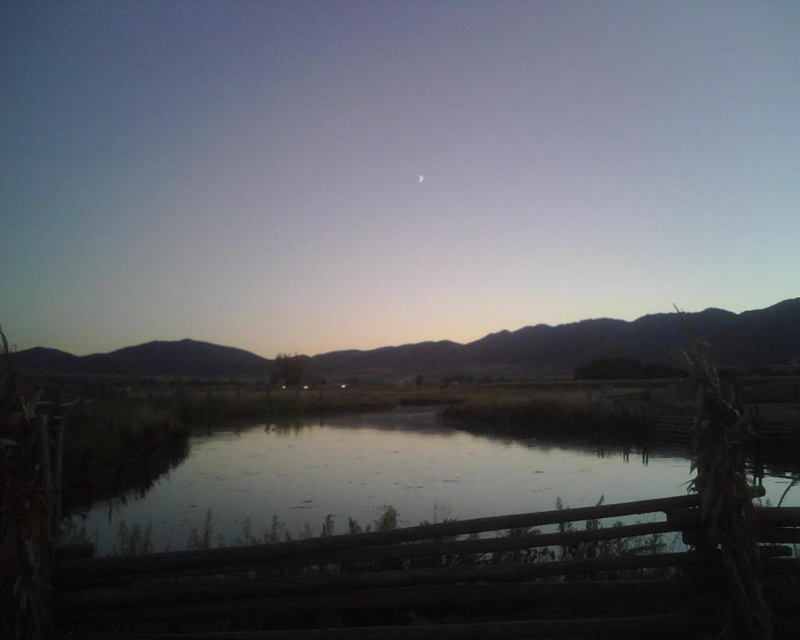
Question: Which of the following is the farthest from the observer?

Choices:
 (A) smooth reflective water at center
 (B) brown matte mountain at center

Answer: (B)

Question: Can you confirm if smooth reflective water at center is positioned to the right of brown matte mountain at center?

Choices:
 (A) no
 (B) yes

Answer: (B)

Question: Is smooth reflective water at center above brown matte mountain at center?

Choices:
 (A) no
 (B) yes

Answer: (A)

Question: Can you confirm if smooth reflective water at center is wider than brown matte mountain at center?

Choices:
 (A) yes
 (B) no

Answer: (B)

Question: Which point appears closest to the camera in this image?

Choices:
 (A) (548, 481)
 (B) (758, 364)

Answer: (A)